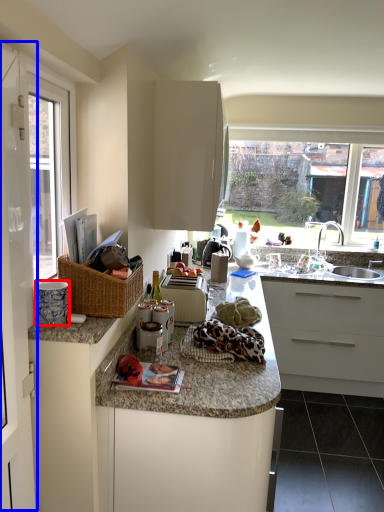
Question: Which object is further to the camera taking this photo, appliance (highlighted by a red box) or screen door (highlighted by a blue box)?

Choices:
 (A) appliance
 (B) screen door

Answer: (A)